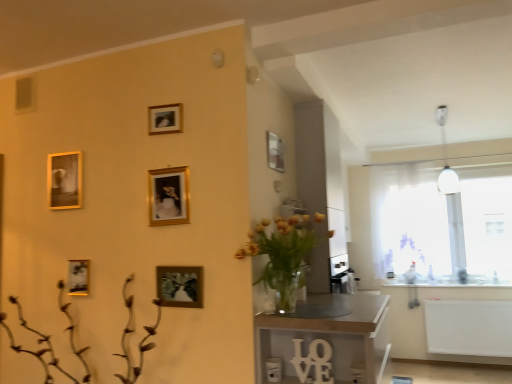
Question: Is brown matte plant at lower left situated inside gold metallic picture frame at lower left, which ranks as the 2th picture frame in left-to-right order, or outside?

Choices:
 (A) outside
 (B) inside

Answer: (A)

Question: Is brown matte plant at lower left in front of or behind gold metallic picture frame at lower left, which is counted as the 4th picture frame, starting from the right, in the image?

Choices:
 (A) behind
 (B) front

Answer: (B)

Question: Estimate the real-world distances between objects in this image. Which object is closer to the gold metallic picture frame at center, which ranks as the first picture frame in right-to-left order?

Choices:
 (A) gold-framed photo at upper left, the 2th picture frame positioned from the top
 (B) white matte radiator at lower right
 (C) wooden table at center
 (D) gold metallic picture frame at lower left, placed as the 2th picture frame when sorted from bottom to top
 (E) metallic silver frame at upper center

Answer: (D)

Question: Considering the real-world distances, which object is farthest from the gold-framed photo at upper left, the 1th picture frame from the left?

Choices:
 (A) gold metallic picture frame at center, marked as the fifth picture frame in a top-to-bottom arrangement
 (B) brown matte plant at lower left
 (C) transparent glass window at right
 (D) gold metallic picture frame at lower left, which ranks as the 2th picture frame in left-to-right order
 (E) gold metallic picture frame at upper center, which is the 3th picture frame in right-to-left order

Answer: (C)